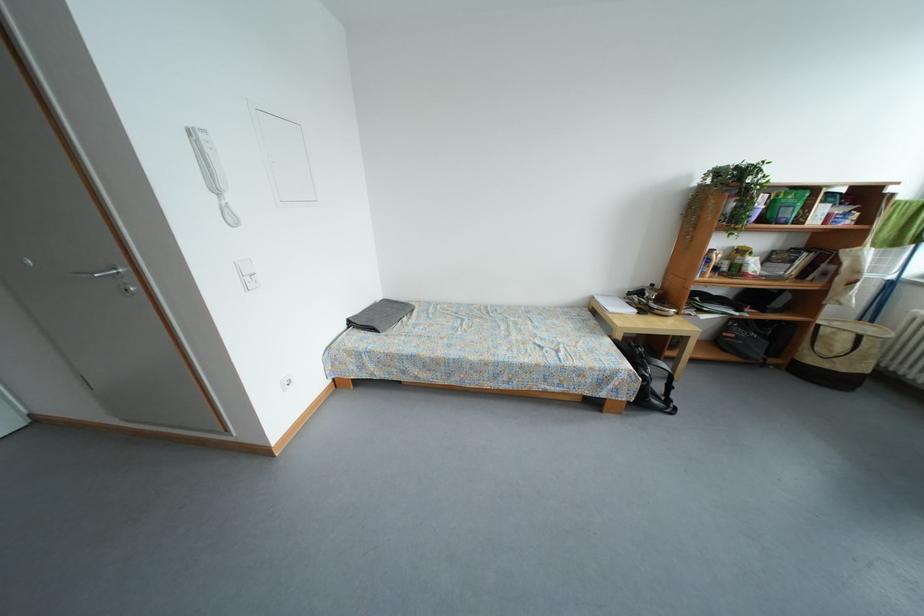
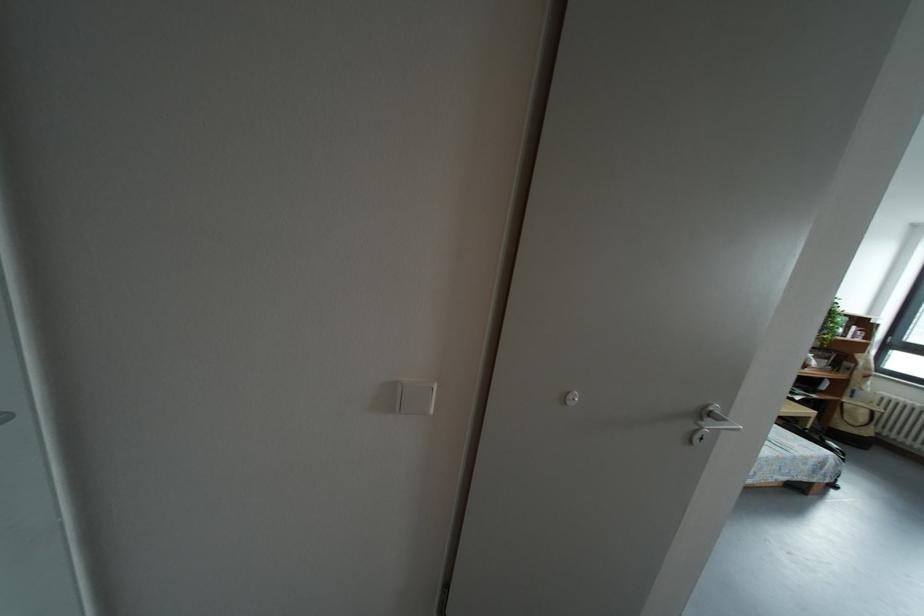
Question: The images are taken continuously from a first-person perspective. In which direction are you moving?

Choices:
 (A) Left
 (B) Right
 (C) Forward
 (D) Backward

Answer: (A)